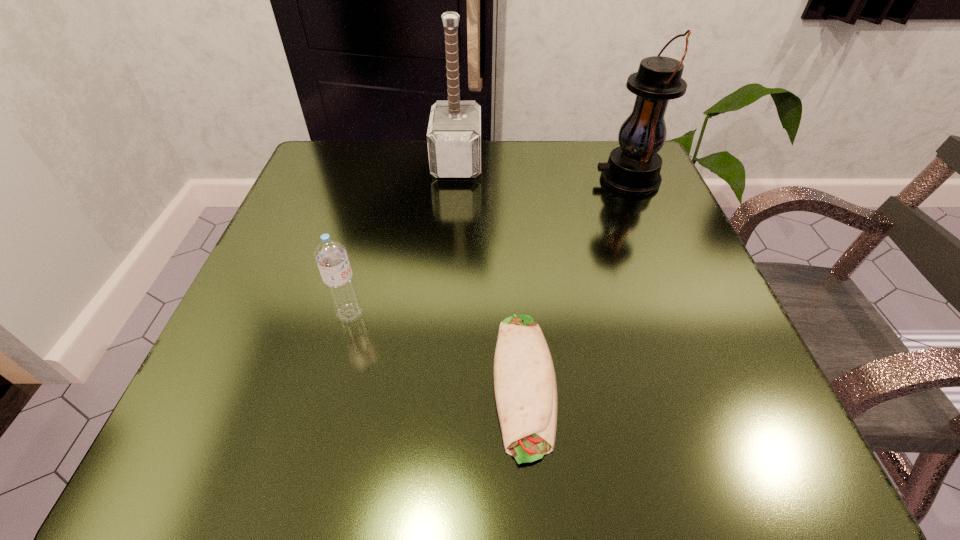
The height and width of the screenshot is (540, 960). In order to click on free space at the far left corner of the desktop in this screenshot , I will do `click(312, 196)`.

In the image, there is a desktop. Where is `free space at the near left corner`? The image size is (960, 540). free space at the near left corner is located at coordinates (227, 443).

In the image, there is a desktop. At what (x,y) coordinates should I click in order to perform the action: click on free region at the near right corner. Please return your answer as a coordinate pair (x, y). Looking at the image, I should click on (759, 410).

At what (x,y) coordinates should I click in order to perform the action: click on empty location between the second object from left to right and the shortest object. Please return your answer as a coordinate pair (x, y). This screenshot has width=960, height=540. Looking at the image, I should click on (491, 272).

Where is `vacant area that lies between the burrito and the hammer`? The width and height of the screenshot is (960, 540). vacant area that lies between the burrito and the hammer is located at coordinates (491, 272).

Identify the location of unoccupied area between the leftmost object and the hammer. (403, 238).

You are a GUI agent. You are given a task and a screenshot of the screen. Output one action in this format:
    pyautogui.click(x=<x>, y=<y>)
    Task: Click on the vacant space that's between the burrito and the hammer
    This screenshot has height=540, width=960.
    Given the screenshot: What is the action you would take?
    pyautogui.click(x=491, y=272)

Where is `vacant region between the lantern and the shortest object`? This screenshot has height=540, width=960. vacant region between the lantern and the shortest object is located at coordinates (576, 280).

Locate an element on the screen. Image resolution: width=960 pixels, height=540 pixels. free space between the water bottle and the lantern is located at coordinates (489, 246).

I want to click on vacant region between the second object from right to left and the water bottle, so click(437, 348).